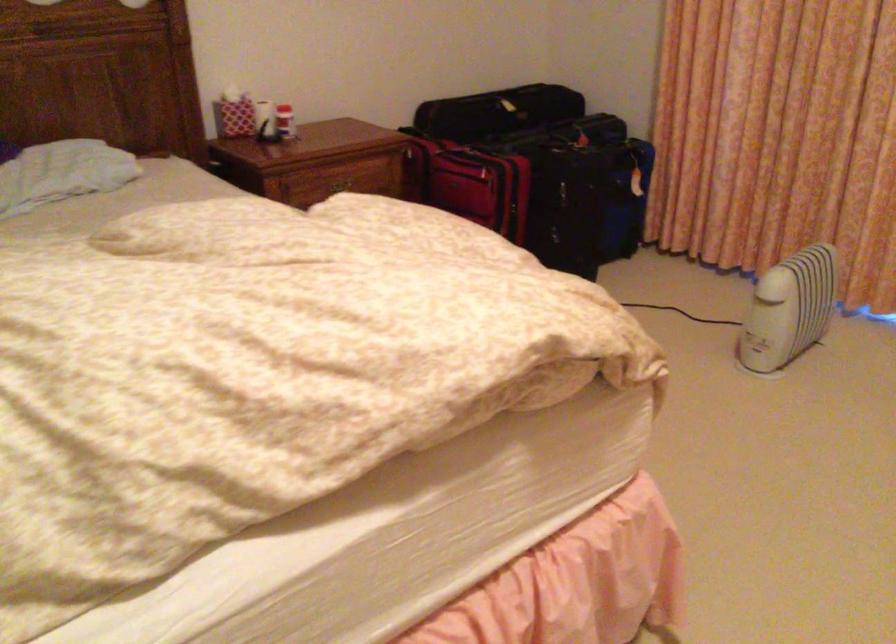
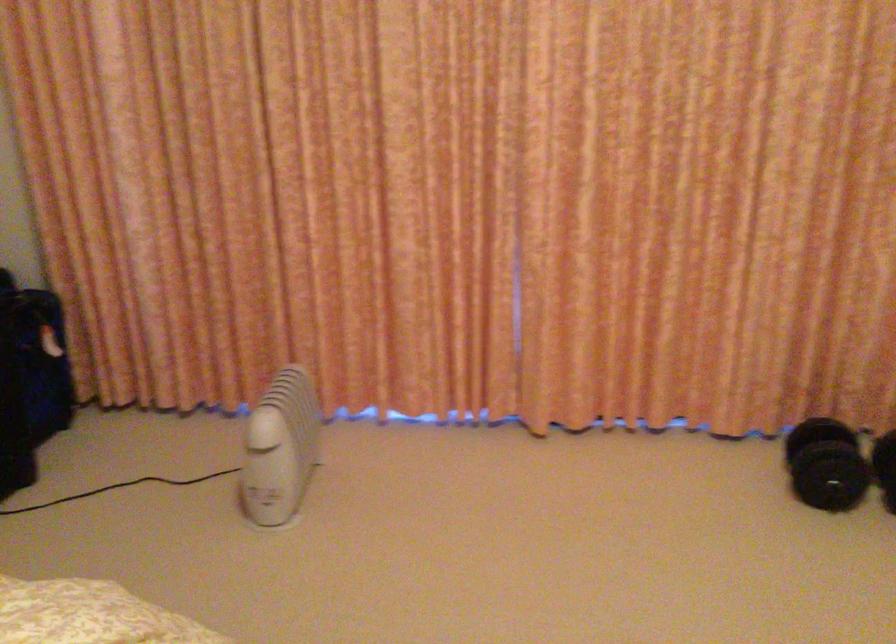
Question: The camera is either moving clockwise (left) or counter-clockwise (right) around the object. The first image is from the beginning of the video and the second image is from the end. Is the camera moving left or right when shooting the video?

Choices:
 (A) Left
 (B) Right

Answer: (A)